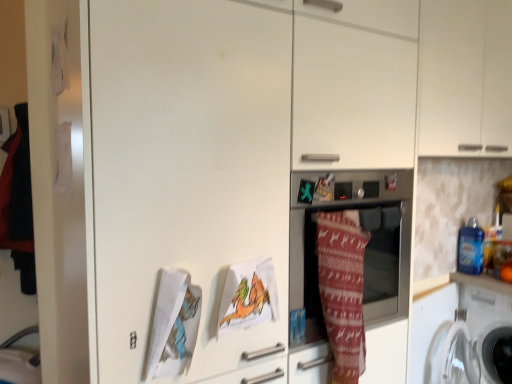
Question: Would you consider white plastic washing machine at lower right, the second washing machine when ordered from left to right, to be distant from metallic oven at center?

Choices:
 (A) no
 (B) yes

Answer: (A)

Question: Is white plastic washing machine at lower right, the second washing machine when ordered from left to right, shorter than metallic oven at center?

Choices:
 (A) no
 (B) yes

Answer: (A)

Question: Is white plastic washing machine at lower right, the second washing machine when ordered from left to right, behind metallic oven at center?

Choices:
 (A) yes
 (B) no

Answer: (A)

Question: From the image's perspective, does white plastic washing machine at lower right, the second washing machine when ordered from left to right, appear higher than metallic oven at center?

Choices:
 (A) yes
 (B) no

Answer: (B)

Question: Is white plastic washing machine at lower right, the second washing machine when ordered from left to right, to the left of metallic oven at center from the viewer's perspective?

Choices:
 (A) yes
 (B) no

Answer: (B)

Question: From the image's perspective, is white plastic washing machine at lower right, positioned as the 1th washing machine in right-to-left order, under metallic oven at center?

Choices:
 (A) yes
 (B) no

Answer: (A)

Question: Is white matte cabinet at upper right at the right side of white plastic washing machine at lower right, which is counted as the second washing machine, starting from the right?

Choices:
 (A) yes
 (B) no

Answer: (B)

Question: Is white matte cabinet at upper right next to white plastic washing machine at lower right, the first washing machine positioned from the left?

Choices:
 (A) yes
 (B) no

Answer: (B)

Question: Is white matte cabinet at upper right not near white plastic washing machine at lower right, which is counted as the second washing machine, starting from the right?

Choices:
 (A) yes
 (B) no

Answer: (B)

Question: Is white matte cabinet at upper right facing towards white plastic washing machine at lower right, which is counted as the second washing machine, starting from the right?

Choices:
 (A) yes
 (B) no

Answer: (B)

Question: From the image's perspective, does white matte cabinet at upper right appear lower than white plastic washing machine at lower right, which is counted as the second washing machine, starting from the right?

Choices:
 (A) no
 (B) yes

Answer: (A)

Question: Does white matte cabinet at upper right have a greater width compared to white plastic washing machine at lower right, which is counted as the second washing machine, starting from the right?

Choices:
 (A) no
 (B) yes

Answer: (B)

Question: Is knitted woolen blanket at center at the right side of white matte cabinet at upper right?

Choices:
 (A) no
 (B) yes

Answer: (A)